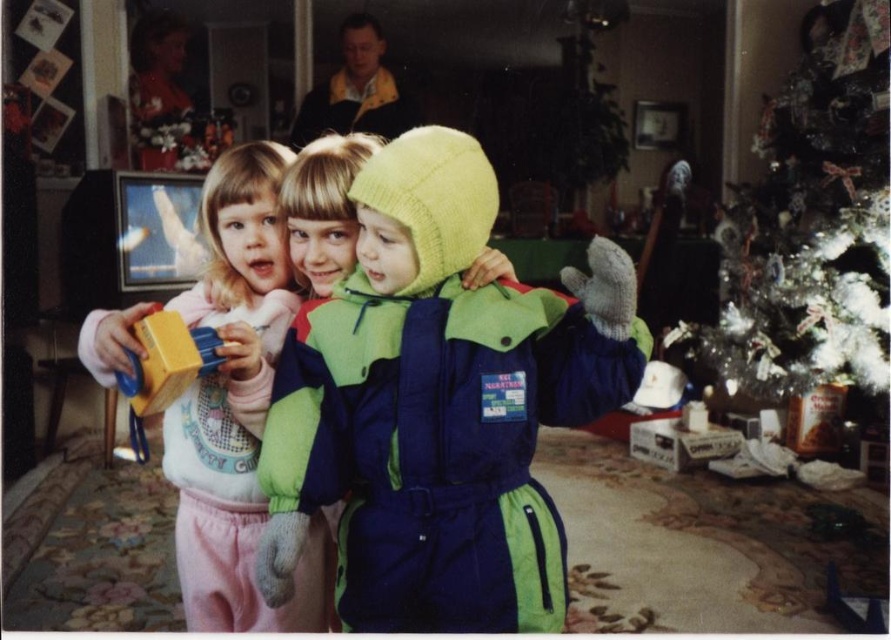
Is the position of matte pink pants at center less distant than that of matte yellow block at center?

No, it is not.

In the scene shown: Who is higher up, matte pink pants at center or matte yellow block at center?

Positioned higher is matte yellow block at center.

The image size is (891, 640). I want to click on matte pink pants at center, so click(x=236, y=406).

Between white glittery christmas tree at upper right and matte yellow block at center, which one appears on the right side from the viewer's perspective?

white glittery christmas tree at upper right is more to the right.

Measure the distance between white glittery christmas tree at upper right and camera.

They are 2.72 meters apart.

You are a GUI agent. You are given a task and a screenshot of the screen. Output one action in this format:
    pyautogui.click(x=<x>, y=<y>)
    Task: Click on the white glittery christmas tree at upper right
    Image resolution: width=891 pixels, height=640 pixels.
    Given the screenshot: What is the action you would take?
    pyautogui.click(x=811, y=224)

Who is more forward, (544, 609) or (144, 416)?

Point (544, 609)

Is multicolored fleece snowsuit at center positioned behind matte yellow block at center?

No, it is in front of matte yellow block at center.

The image size is (891, 640). What do you see at coordinates (439, 404) in the screenshot?
I see `multicolored fleece snowsuit at center` at bounding box center [439, 404].

What are the coordinates of `multicolored fleece snowsuit at center` in the screenshot? It's located at (439, 404).